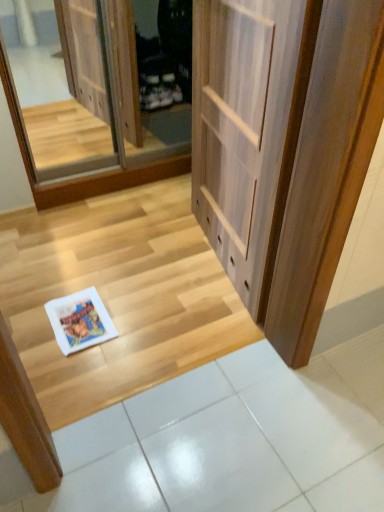
Where is `vacant space to the left of light wood door at center`? This screenshot has height=512, width=384. vacant space to the left of light wood door at center is located at coordinates (125, 262).